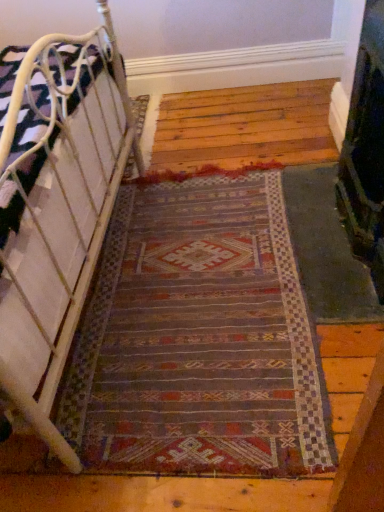
Question: Should I look upward or downward to see dark green textured fireplace at right?

Choices:
 (A) down
 (B) up

Answer: (B)

Question: Does dark green textured fireplace at right have a lesser width compared to multicolored woven rug at center?

Choices:
 (A) yes
 (B) no

Answer: (A)

Question: From the image's perspective, is dark green textured fireplace at right above multicolored woven rug at center?

Choices:
 (A) no
 (B) yes

Answer: (B)

Question: From the image's perspective, is dark green textured fireplace at right located beneath multicolored woven rug at center?

Choices:
 (A) no
 (B) yes

Answer: (A)

Question: Considering the relative sizes of dark green textured fireplace at right and multicolored woven rug at center in the image provided, is dark green textured fireplace at right taller than multicolored woven rug at center?

Choices:
 (A) yes
 (B) no

Answer: (A)

Question: Does dark green textured fireplace at right have a lesser height compared to multicolored woven rug at center?

Choices:
 (A) yes
 (B) no

Answer: (B)

Question: Is dark green textured fireplace at right wider than multicolored woven rug at center?

Choices:
 (A) yes
 (B) no

Answer: (B)

Question: Does multicolored woven rug at center have a smaller size compared to white metal bed at left?

Choices:
 (A) yes
 (B) no

Answer: (A)

Question: Can you confirm if multicolored woven rug at center is bigger than white metal bed at left?

Choices:
 (A) no
 (B) yes

Answer: (A)

Question: Is multicolored woven rug at center positioned with its back to white metal bed at left?

Choices:
 (A) yes
 (B) no

Answer: (B)

Question: Is multicolored woven rug at center outside of white metal bed at left?

Choices:
 (A) yes
 (B) no

Answer: (A)

Question: Is multicolored woven rug at center closer to the viewer compared to white metal bed at left?

Choices:
 (A) yes
 (B) no

Answer: (B)

Question: Can you see multicolored woven rug at center touching white metal bed at left?

Choices:
 (A) yes
 (B) no

Answer: (B)

Question: Considering the relative sizes of white metal bed at left and multicolored woven rug at center in the image provided, is white metal bed at left smaller than multicolored woven rug at center?

Choices:
 (A) yes
 (B) no

Answer: (B)